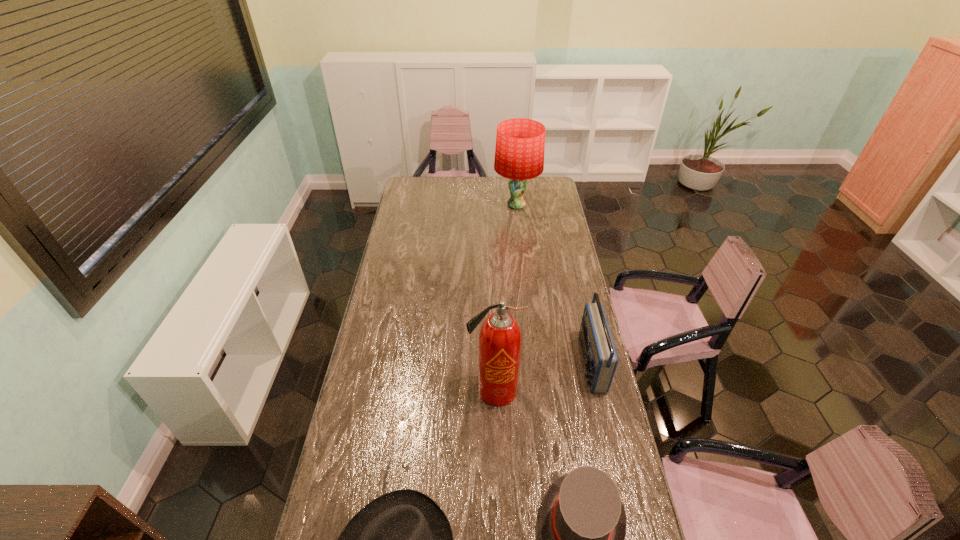
Where is `lampshade`? lampshade is located at coordinates (520, 143).

Image resolution: width=960 pixels, height=540 pixels. Find the location of `fire extinguisher`. fire extinguisher is located at coordinates (499, 348).

This screenshot has width=960, height=540. Find the location of `the third shortest object`. the third shortest object is located at coordinates (600, 358).

The width and height of the screenshot is (960, 540). I want to click on free region located on the front-facing side of the farthest object, so click(x=472, y=205).

Where is `vacant region located 0.230m on the front-facing side of the farthest object`? This screenshot has height=540, width=960. vacant region located 0.230m on the front-facing side of the farthest object is located at coordinates (453, 205).

In order to click on vacant space situated 0.400m on the front-facing side of the farthest object in this screenshot , I will do `click(424, 205)`.

This screenshot has width=960, height=540. I want to click on blank area located on the front of the fire extinguisher, so [496, 458].

Locate an element on the screen. vacant space located 0.250m on the front panel of the third shortest object is located at coordinates (516, 363).

At what (x,y) coordinates should I click in order to perform the action: click on vacant region located on the front panel of the third shortest object. Please return your answer as a coordinate pair (x, y). The image size is (960, 540). Looking at the image, I should click on (498, 363).

The width and height of the screenshot is (960, 540). I want to click on free spot located 0.130m on the front panel of the third shortest object, so click(547, 363).